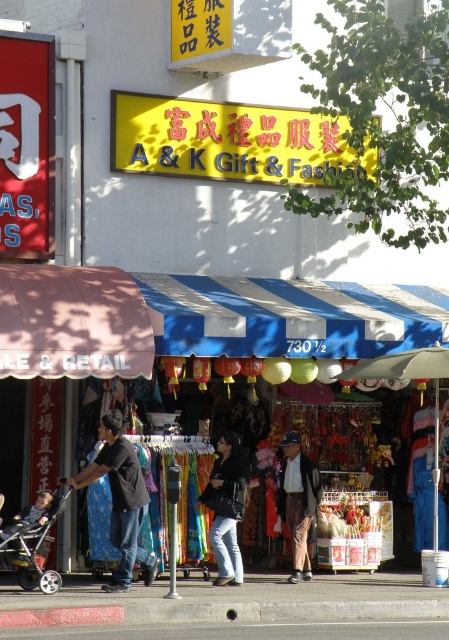
Question: Observing the image, what is the correct spatial positioning of yellow matte sign at upper center in reference to brown leather jacket at center?

Choices:
 (A) below
 (B) above

Answer: (B)

Question: Is black matte shirt at center above metallic silver stroller at lower left?

Choices:
 (A) yes
 (B) no

Answer: (A)

Question: Is metallic silver stroller at lower left above brown leather jacket at center?

Choices:
 (A) no
 (B) yes

Answer: (A)

Question: Which point appears farthest from the camera in this image?

Choices:
 (A) (325, 154)
 (B) (21, 541)

Answer: (A)

Question: Which point appears closest to the camera in this image?

Choices:
 (A) (237, 518)
 (B) (130, 582)
 (C) (0, 550)

Answer: (C)

Question: Which point is closer to the camera taking this photo?

Choices:
 (A) (293, 134)
 (B) (110, 474)

Answer: (B)